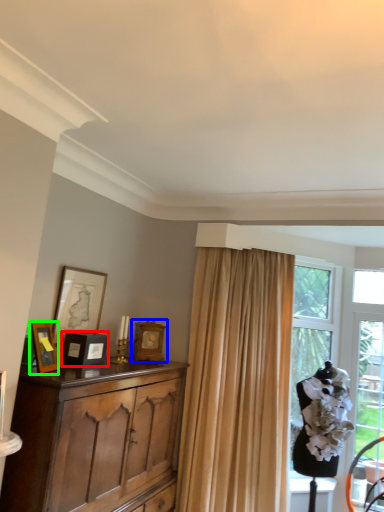
Question: Which object is positioned farthest from picture frame (highlighted by a red box)? Select from picture frame (highlighted by a blue box) and picture frame (highlighted by a green box).

Choices:
 (A) picture frame
 (B) picture frame

Answer: (A)